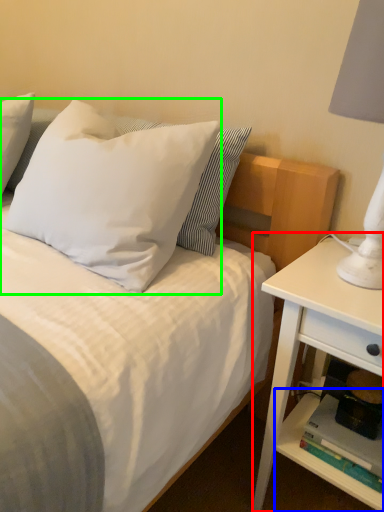
Question: Estimate the real-world distances between objects in this image. Which object is closer to nightstand (highlighted by a red box), shelf (highlighted by a blue box) or pillow (highlighted by a green box)?

Choices:
 (A) shelf
 (B) pillow

Answer: (A)